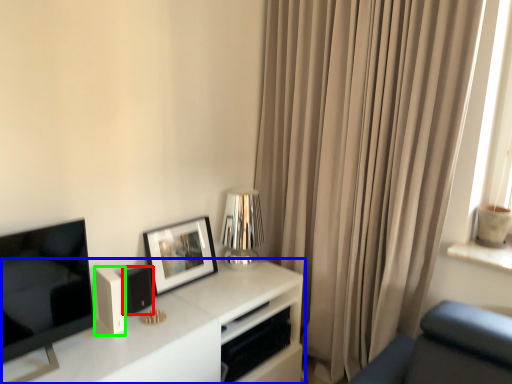
Question: Estimate the real-world distances between objects in this image. Which object is closer to speaker (highlighted by a red box), table (highlighted by a blue box) or appliance (highlighted by a green box)?

Choices:
 (A) table
 (B) appliance

Answer: (B)